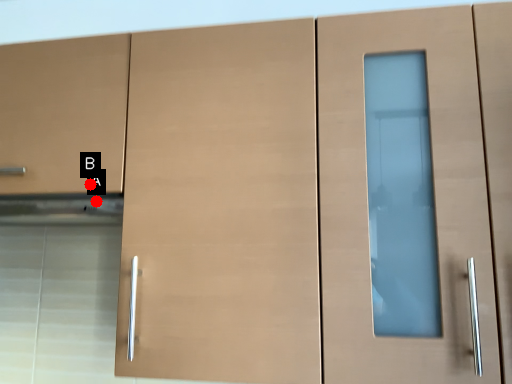
Question: Two points are circled on the image, labeled by A and B beside each circle. Which point is farther from the camera taking this photo?

Choices:
 (A) A is further
 (B) B is further

Answer: (A)